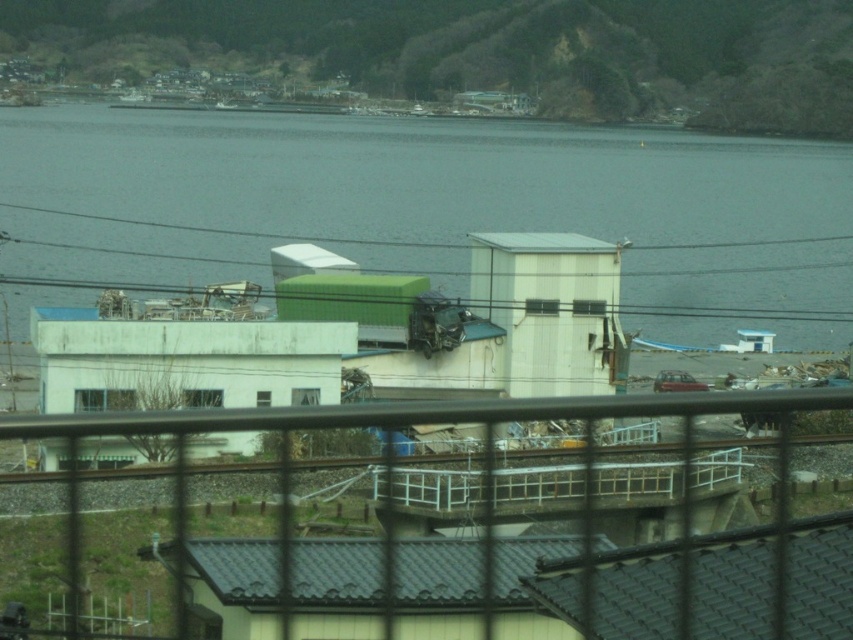
Can you confirm if white matte building at center is shorter than metallic wire fence at center?

No.

Does white matte building at center appear under metallic wire fence at center?

No.

Describe the element at coordinates (358, 333) in the screenshot. I see `white matte building at center` at that location.

Locate an element on the screen. This screenshot has height=640, width=853. white matte building at center is located at coordinates (358, 333).

Who is lower down, white matte building at center or green matte power line at center?

white matte building at center

Can you confirm if white matte building at center is bigger than green matte power line at center?

No.

Who is more distant from viewer, (x=344, y=316) or (x=656, y=273)?

The point (x=656, y=273) is behind.

Identify the location of white matte building at center. The width and height of the screenshot is (853, 640). (358, 333).

Is point (490, 509) positioned after point (672, 308)?

No.

Which is more to the right, metallic wire fence at center or green matte power line at center?

green matte power line at center

The image size is (853, 640). In order to click on metallic wire fence at center in this screenshot , I will do `click(480, 474)`.